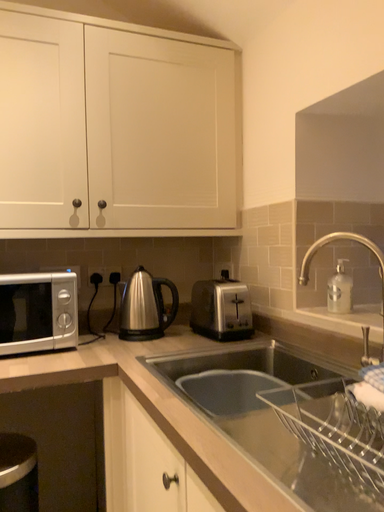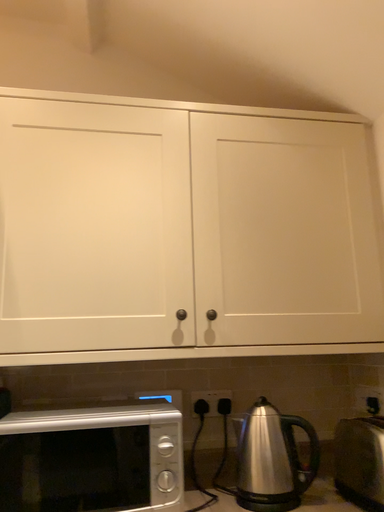
Question: How did the camera likely rotate when shooting the video?

Choices:
 (A) rotated left
 (B) rotated right

Answer: (A)